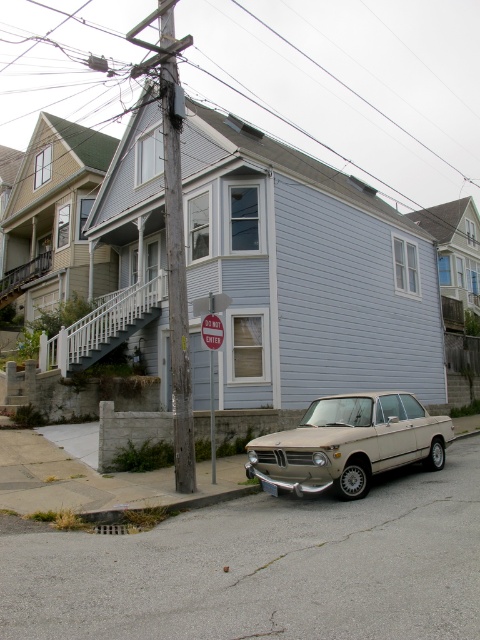
Question: Is metallic wire at upper center behind red painted metal stop sign at center?

Choices:
 (A) yes
 (B) no

Answer: (A)

Question: Which point is farther from the camera taking this photo?

Choices:
 (A) click(157, 56)
 (B) click(112, 83)
 (C) click(211, 499)
 (D) click(205, 324)

Answer: (B)

Question: Does metallic wire at upper center have a lesser width compared to wooden utility pole at center?

Choices:
 (A) no
 (B) yes

Answer: (A)

Question: Which of the following is the closest to the observer?

Choices:
 (A) gray concrete curb at lower center
 (B) beige matte sedan at center

Answer: (A)

Question: Can you confirm if gray concrete curb at lower center is thinner than red painted metal stop sign at center?

Choices:
 (A) yes
 (B) no

Answer: (B)

Question: Which of the following is the closest to the observer?

Choices:
 (A) (178, 410)
 (B) (210, 342)
 (C) (141, 515)
 (D) (377, 164)

Answer: (C)